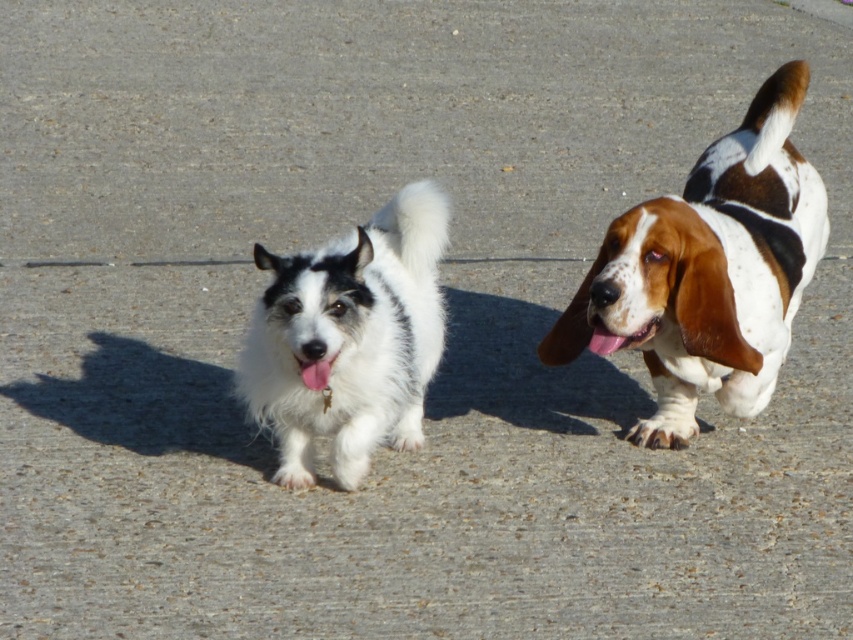
Does white fluffy dog at center have a smaller size compared to white fur tongue at center?

No.

Who is lower down, white fluffy dog at center or white fur tongue at center?

white fur tongue at center

Who is more forward, (274, 289) or (328, 364)?

Positioned in front is point (328, 364).

Locate an element on the screen. The height and width of the screenshot is (640, 853). white fluffy dog at center is located at coordinates (349, 339).

Does brown and white fur dog at right have a greater width compared to white fur tongue at center?

Correct, the width of brown and white fur dog at right exceeds that of white fur tongue at center.

In order to click on brown and white fur dog at right in this screenshot , I will do `click(708, 272)`.

Does point (666, 300) come in front of point (323, 371)?

That is False.

The height and width of the screenshot is (640, 853). Find the location of `brown and white fur dog at right`. brown and white fur dog at right is located at coordinates (708, 272).

Is point (769, 88) closer to viewer compared to point (415, 205)?

No, it is not.

Does point (728, 324) come behind point (374, 422)?

No, (728, 324) is in front of (374, 422).

This screenshot has width=853, height=640. I want to click on brown and white fur dog at right, so click(708, 272).